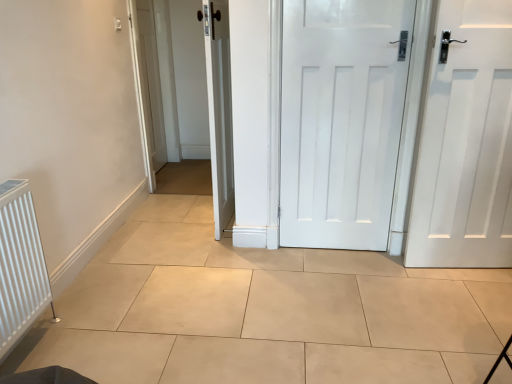
At what (x,y) coordinates should I click in order to perform the action: click on vacant space situated on the left part of white wooden door at center, the 1th door in the left-to-right sequence. Please return your answer as a coordinate pair (x, y). Looking at the image, I should click on (170, 218).